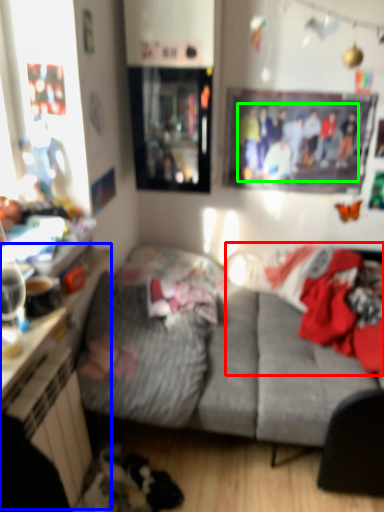
Question: Which object is the farthest from laundry (highlighted by a red box)? Choose among these: dresser (highlighted by a blue box) or couple (highlighted by a green box).

Choices:
 (A) dresser
 (B) couple

Answer: (A)